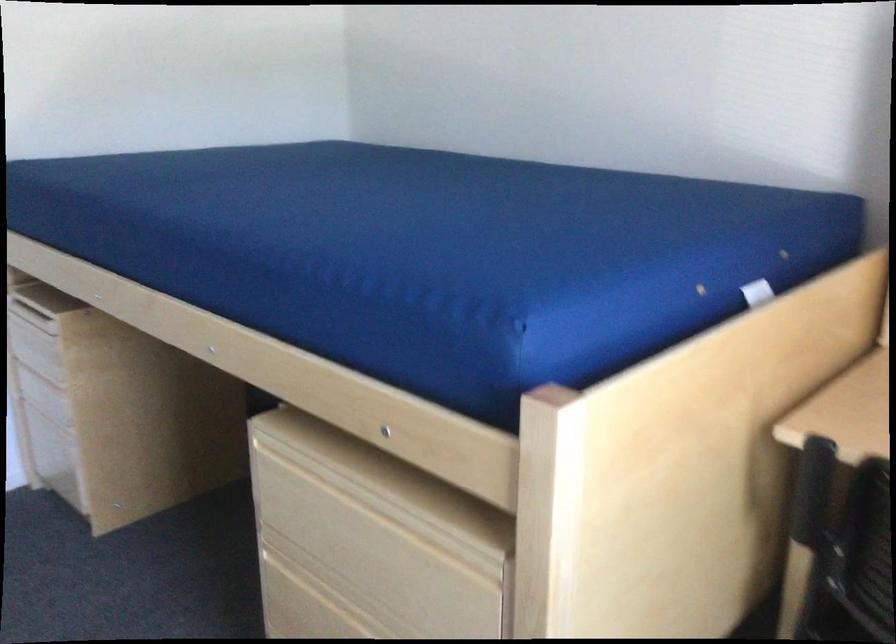
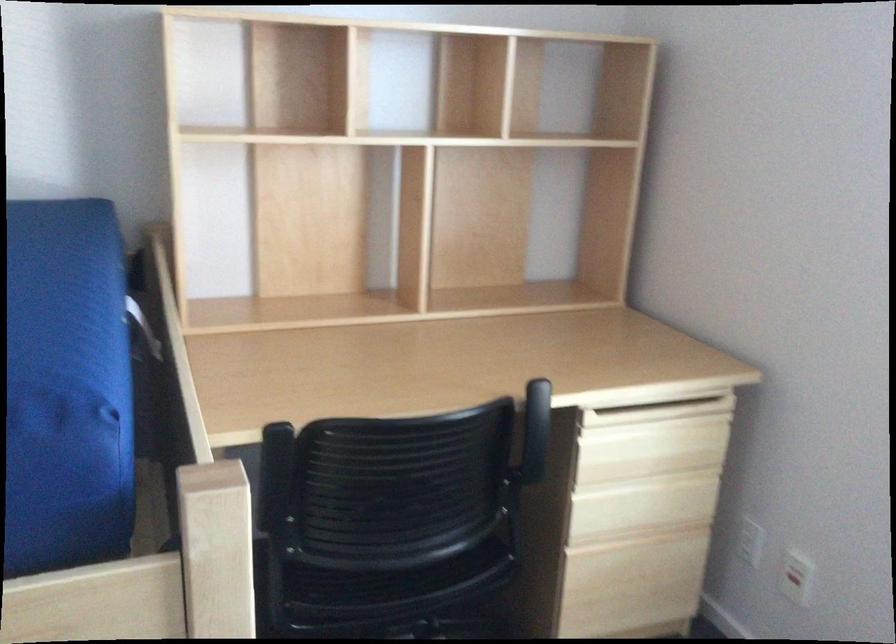
In the second image, find the point that corresponds to pixel 807 489 in the first image.

(273, 474)